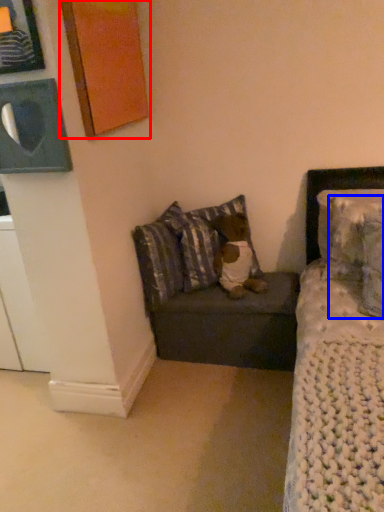
Question: Which object appears farthest to the camera in this image, picture frame (highlighted by a red box) or pillow (highlighted by a blue box)?

Choices:
 (A) picture frame
 (B) pillow

Answer: (A)